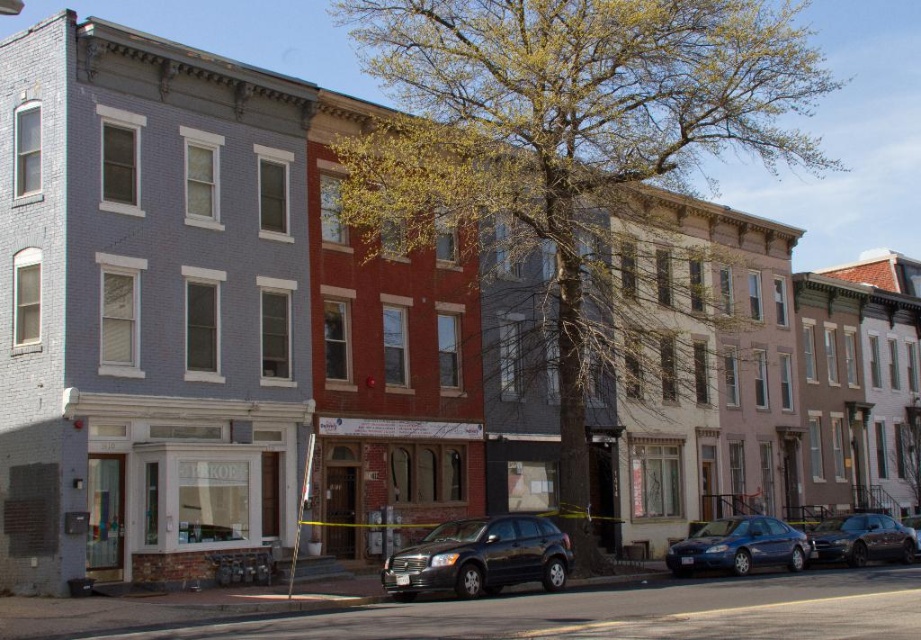
You are standing at the intersection and want to park your car. There is a metallic blue sedan at lower right. Can you park your car in the parking spot located at point (739, 547)?

The parking spot at point (739, 547) is occupied by a metallic blue sedan at lower right, so you cannot park there.

In the scene shown: You are a pedestrian standing on the sidewalk in front of the buildings. You notice a green leafy tree at center and a metallic blue sedan at lower right. Which object is higher from the ground?

The green leafy tree at center is above metallic blue sedan at lower right, so the tree is higher from the ground.